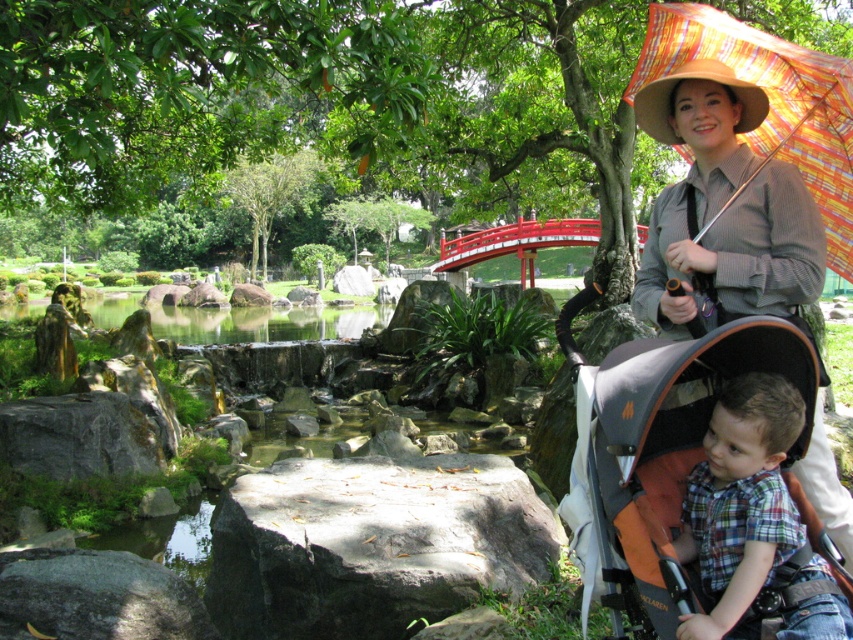
Who is taller, matte brown shirt at upper right or orange fabric stroller at lower right?

matte brown shirt at upper right is taller.

Can you confirm if matte brown shirt at upper right is taller than orange fabric stroller at lower right?

Yes.

Image resolution: width=853 pixels, height=640 pixels. What do you see at coordinates (723, 211) in the screenshot?
I see `matte brown shirt at upper right` at bounding box center [723, 211].

Locate an element on the screen. This screenshot has height=640, width=853. matte brown shirt at upper right is located at coordinates (723, 211).

Is orange fabric stroller at lower right to the left of plaid cotton shirt at lower right from the viewer's perspective?

Indeed, orange fabric stroller at lower right is positioned on the left side of plaid cotton shirt at lower right.

Between point (849, 582) and point (770, 435), which one is positioned behind?

Point (849, 582)

Is point (778, 353) less distant than point (779, 566)?

No, (778, 353) is behind (779, 566).

Where is `orange fabric stroller at lower right`? This screenshot has width=853, height=640. orange fabric stroller at lower right is located at coordinates pyautogui.click(x=668, y=451).

Is orange fabric stroller at lower right further to the viewer compared to green smooth water at center?

That is False.

Does orange fabric stroller at lower right have a larger size compared to green smooth water at center?

Actually, orange fabric stroller at lower right might be smaller than green smooth water at center.

Which is behind, point (728, 333) or point (6, 308)?

Point (6, 308)

This screenshot has width=853, height=640. I want to click on orange fabric stroller at lower right, so click(668, 451).